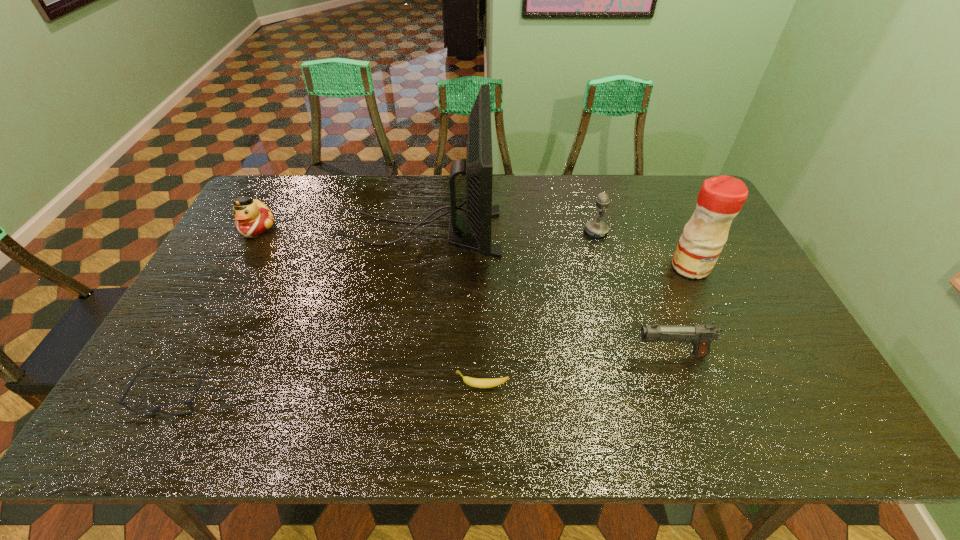
This screenshot has width=960, height=540. Find the location of `free region at the left edge of the desktop`. free region at the left edge of the desktop is located at coordinates (170, 357).

Where is `vacant space at the right edge of the desktop`? vacant space at the right edge of the desktop is located at coordinates (789, 390).

Find the location of a particular element. Image resolution: width=960 pixels, height=540 pixels. vacant region at the far right corner is located at coordinates (682, 177).

I want to click on empty space that is in between the spectacles and the duck, so click(x=216, y=310).

You are a GUI agent. You are given a task and a screenshot of the screen. Output one action in this format:
    pyautogui.click(x=<x>, y=<y>)
    Task: Click on the vacant point located between the tallest object and the banana
    This screenshot has height=540, width=960.
    Given the screenshot: What is the action you would take?
    pyautogui.click(x=450, y=309)

Find the location of a particular element. Image resolution: width=960 pixels, height=540 pixels. vacant region between the microphone and the banana is located at coordinates (540, 308).

I want to click on free space that is in between the computer monitor and the microphone, so click(x=507, y=232).

Locate an element on the screen. This screenshot has width=960, height=540. empty location between the spectacles and the gun is located at coordinates (423, 374).

Identify the location of free space between the third nearest object and the banana. The image size is (960, 540). (577, 370).

The image size is (960, 540). Find the location of `free space between the spectacles and the gun`. free space between the spectacles and the gun is located at coordinates (423, 374).